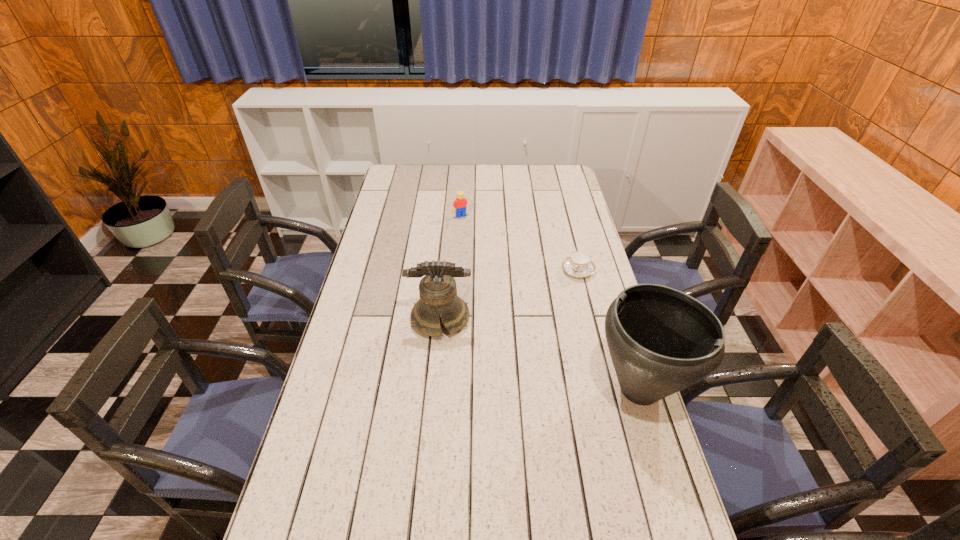
In the image, there is a desktop. Identify the location of vacant space at the right edge. (572, 316).

Identify the location of vacant space at the far right corner of the desktop. The width and height of the screenshot is (960, 540). (560, 172).

This screenshot has width=960, height=540. Identify the location of vacant point located between the farthest object and the urn. (550, 302).

Where is `unoccupied area between the shortest object and the second tallest object`? The height and width of the screenshot is (540, 960). unoccupied area between the shortest object and the second tallest object is located at coordinates (509, 295).

You are a GUI agent. You are given a task and a screenshot of the screen. Output one action in this format:
    pyautogui.click(x=<x>, y=<y>)
    Task: Click on the vacant region between the third farthest object and the urn
    The image size is (960, 540).
    Given the screenshot: What is the action you would take?
    pyautogui.click(x=540, y=354)

The image size is (960, 540). I want to click on free space between the nearest object and the second nearest object, so click(x=540, y=354).

Identify the location of unoccupied area between the tallest object and the second shortest object. The height and width of the screenshot is (540, 960). pos(550,302).

You are a GUI agent. You are given a task and a screenshot of the screen. Output one action in this format:
    pyautogui.click(x=<x>, y=<y>)
    Task: Click on the free space between the Lego and the nearest object
    The height and width of the screenshot is (540, 960).
    Given the screenshot: What is the action you would take?
    550,302

You are a GUI agent. You are given a task and a screenshot of the screen. Output one action in this format:
    pyautogui.click(x=<x>, y=<y>)
    Task: Click on the free spot between the nearest object and the third shortest object
    This screenshot has width=960, height=540.
    Given the screenshot: What is the action you would take?
    pyautogui.click(x=540, y=354)

Identify which object is located as the nearest to the bell. Please provide its 2D coordinates. Your answer should be formatted as a tuple, i.e. [(x, y)], where the tuple contains the x and y coordinates of a point satisfying the conditions above.

[(579, 264)]